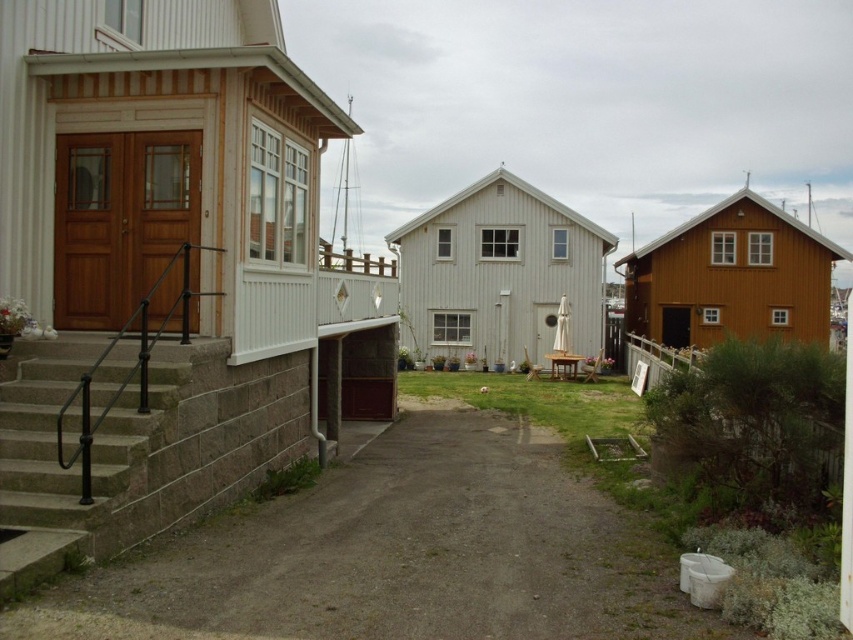
Question: Which point is farther from the camera taking this photo?

Choices:
 (A) (149, 416)
 (B) (0, 630)

Answer: (A)

Question: Which of the following is the farthest from the observer?

Choices:
 (A) (670, 550)
 (B) (103, 465)

Answer: (A)

Question: In this image, where is dirt/gravel driveway at center located relative to brown stone stairs at left?

Choices:
 (A) left
 (B) right

Answer: (B)

Question: Does dirt/gravel driveway at center come in front of brown stone stairs at left?

Choices:
 (A) no
 (B) yes

Answer: (B)

Question: Can you confirm if dirt/gravel driveway at center is smaller than brown stone stairs at left?

Choices:
 (A) no
 (B) yes

Answer: (A)